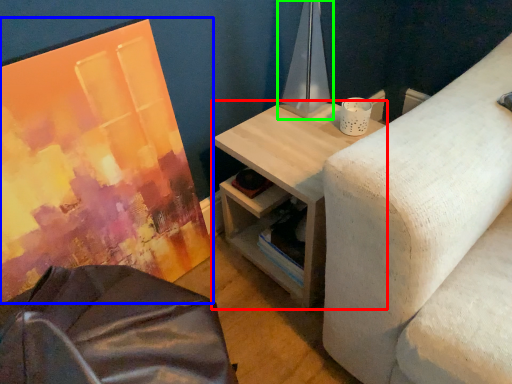
Question: Which object is the farthest from table (highlighted by a red box)? Choose among these: canvas (highlighted by a blue box) or table lamp (highlighted by a green box).

Choices:
 (A) canvas
 (B) table lamp

Answer: (A)